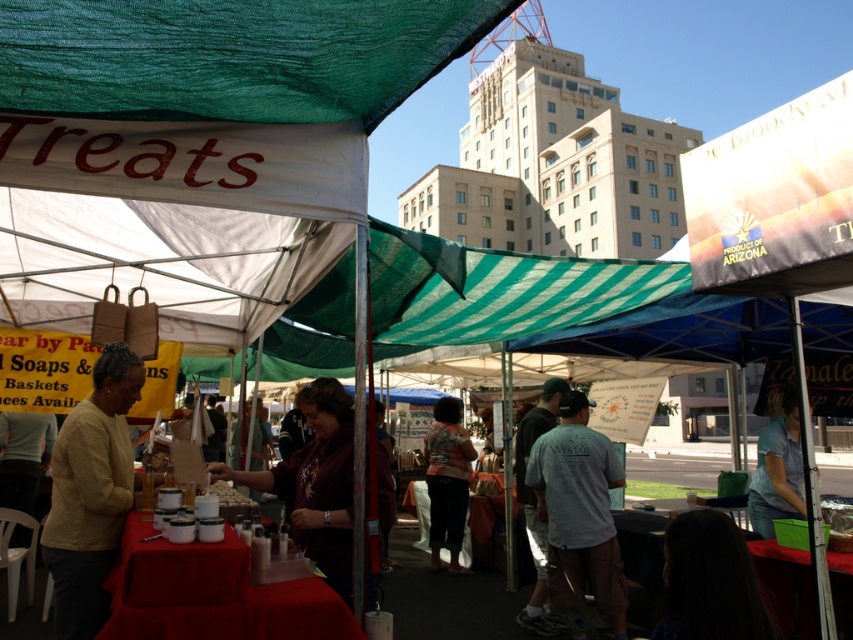
Question: Is light gray cotton shirt at center bigger than floral-patterned shirt at center?

Choices:
 (A) yes
 (B) no

Answer: (A)

Question: Does light gray cotton shirt at center appear under floral-patterned shirt at center?

Choices:
 (A) yes
 (B) no

Answer: (B)

Question: Based on their relative distances, which object is nearer to the floral-patterned shirt at center?

Choices:
 (A) yellow knitted sweater at left
 (B) light gray cotton shirt at center

Answer: (B)

Question: Which of the following is the closest to the observer?

Choices:
 (A) (457, 524)
 (B) (120, 401)
 (C) (541, 500)

Answer: (B)

Question: Which point appears closest to the camera in this image?

Choices:
 (A) (90, 436)
 (B) (445, 444)
 (C) (576, 557)

Answer: (A)

Question: In this image, where is yellow knitted sweater at left located relative to floral-patterned shirt at center?

Choices:
 (A) left
 (B) right

Answer: (A)